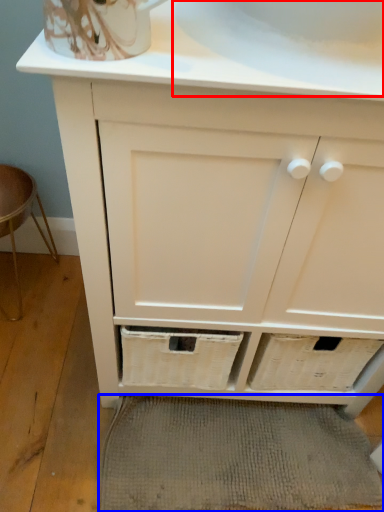
Question: Among these objects, which one is nearest to the camera, sink (highlighted by a red box) or bath mat (highlighted by a blue box)?

Choices:
 (A) sink
 (B) bath mat

Answer: (A)